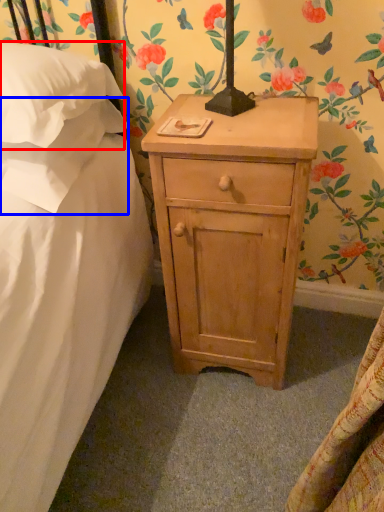
Question: Which of the following is the farthest to the observer, pillow (highlighted by a red box) or pillow (highlighted by a blue box)?

Choices:
 (A) pillow
 (B) pillow

Answer: (B)